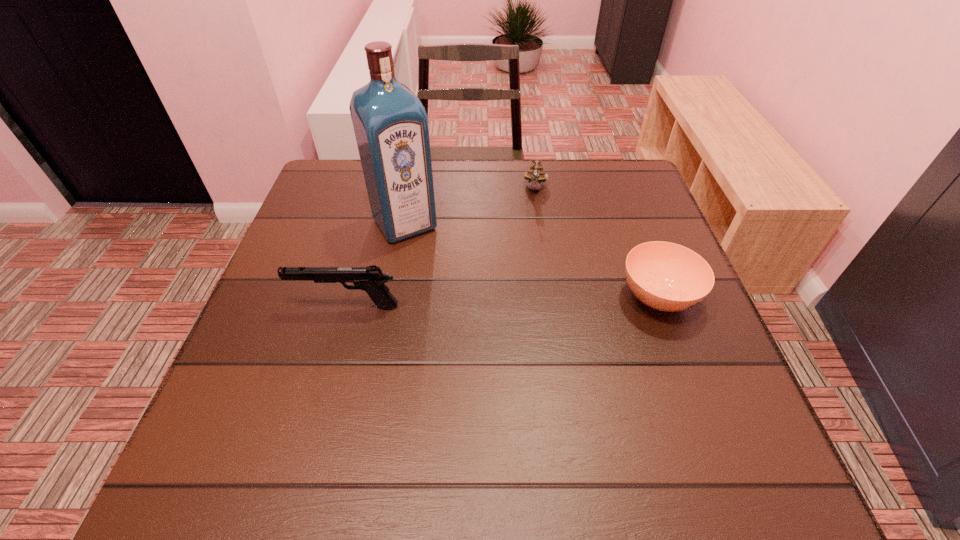
The image size is (960, 540). In order to click on vacant space on the desktop that is between the gun and the soup bowl and is positioned on the face of the farthest object in this screenshot , I will do `click(519, 301)`.

Image resolution: width=960 pixels, height=540 pixels. What are the coordinates of `free space on the desktop that is between the gun and the shortest object and is positioned on the flat label side of the liquor` in the screenshot? It's located at (458, 302).